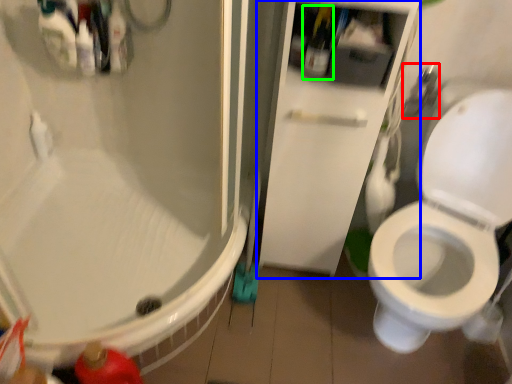
Question: Which object is the farthest from shower (highlighted by a red box)? Choose among these: screen door (highlighted by a blue box) or bottle (highlighted by a green box).

Choices:
 (A) screen door
 (B) bottle

Answer: (A)